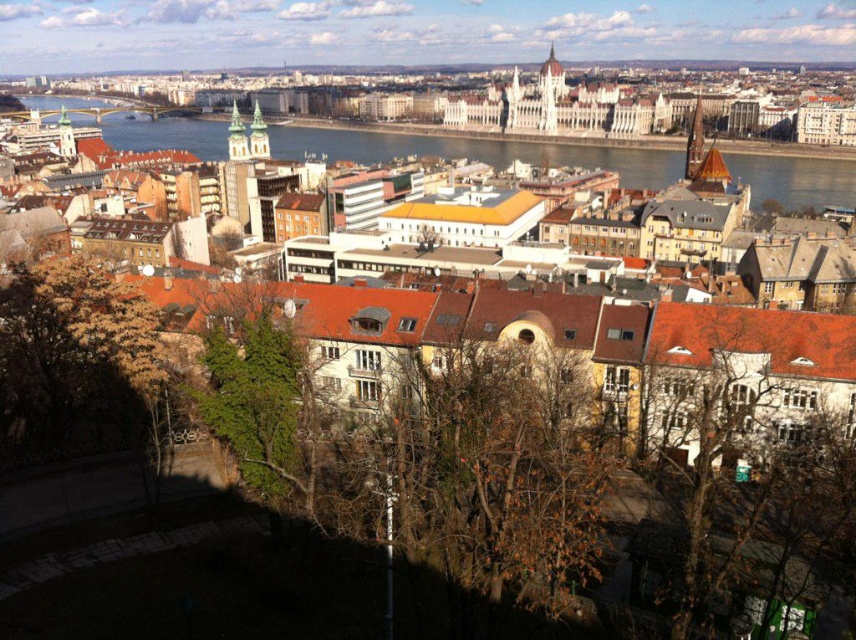
Question: Can you confirm if white stone building at upper center is positioned below blue glass water at upper center?

Choices:
 (A) no
 (B) yes

Answer: (A)

Question: Does white stone building at upper center have a lesser width compared to blue glass water at upper center?

Choices:
 (A) yes
 (B) no

Answer: (B)

Question: Which point is farther to the camera?

Choices:
 (A) blue glass water at upper center
 (B) brown textured building at center
 (C) white stone building at upper center

Answer: (C)

Question: Which of the following is the farthest from the observer?

Choices:
 (A) white stone building at upper center
 (B) blue glass water at upper center

Answer: (A)

Question: Which object is positioned farthest from the blue glass water at upper center?

Choices:
 (A) brown textured building at center
 (B) white stone building at upper center

Answer: (B)

Question: Is white stone building at upper center bigger than brown textured building at center?

Choices:
 (A) no
 (B) yes

Answer: (A)